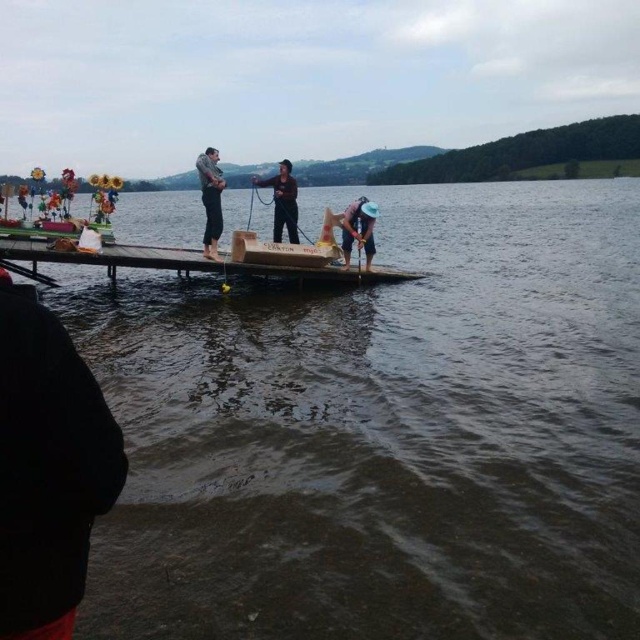
You are standing on the platform and want to move from one point to another. Which point, point (218, 192) or point (356, 208), is closer to you?

Point (218, 192) is closer to the viewer than point (356, 208).

You are a photographer trying to capture a group photo of the two people wearing the gray flannel shirt at center and the black matte shirt at center. Since you want to ensure both are clearly visible, which shirt should you focus on first to avoid blurriness due to size differences?

The gray flannel shirt at center is smaller than the black matte shirt at center. Since the gray flannel shirt at center is smaller, it might be harder to focus on due to its size, so you should focus on the black matte shirt at center first to ensure clarity.

You are planning to buy a new shirt for a casual day out. You see two shirts in the store, the gray flannel shirt at center and the black matte shirt at center. Which shirt is narrower in width?

The gray flannel shirt at center is narrower than the black matte shirt at center.